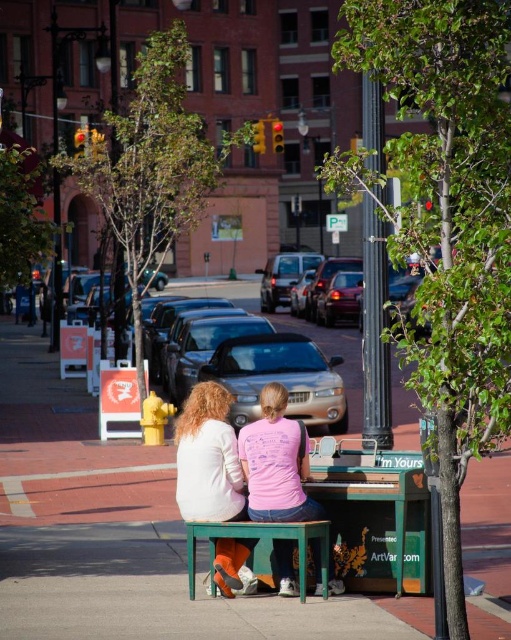
Does green wooden bench at center appear on the left side of matte pink shirt at center?

Indeed, green wooden bench at center is positioned on the left side of matte pink shirt at center.

Identify the location of green wooden bench at center. The width and height of the screenshot is (511, 640). (94, 520).

The width and height of the screenshot is (511, 640). What do you see at coordinates (94, 520) in the screenshot?
I see `green wooden bench at center` at bounding box center [94, 520].

Find the location of `green wooden bench at center`. green wooden bench at center is located at coordinates (94, 520).

Consider the image. Does green matte piano at center have a lesser height compared to matte pink shirt at center?

In fact, green matte piano at center may be taller than matte pink shirt at center.

Which of these two, green matte piano at center or matte pink shirt at center, stands shorter?

matte pink shirt at center

Does point (336, 480) come closer to viewer compared to point (203, 419)?

That is False.

Identify the location of green matte piano at center. (377, 518).

Can you confirm if green leafy tree at center is bigger than green leafy tree at upper center?

Correct, green leafy tree at center is larger in size than green leafy tree at upper center.

Is point (463, 465) farther from camera compared to point (113, 163)?

No.

Is point (350, 45) positioned in front of point (187, 38)?

That is True.

You are a GUI agent. You are given a task and a screenshot of the screen. Output one action in this format:
    pyautogui.click(x=<x>, y=<y>)
    Task: Click on the green leafy tree at center
    The width and height of the screenshot is (511, 640).
    Given the screenshot: What is the action you would take?
    pyautogui.click(x=444, y=221)